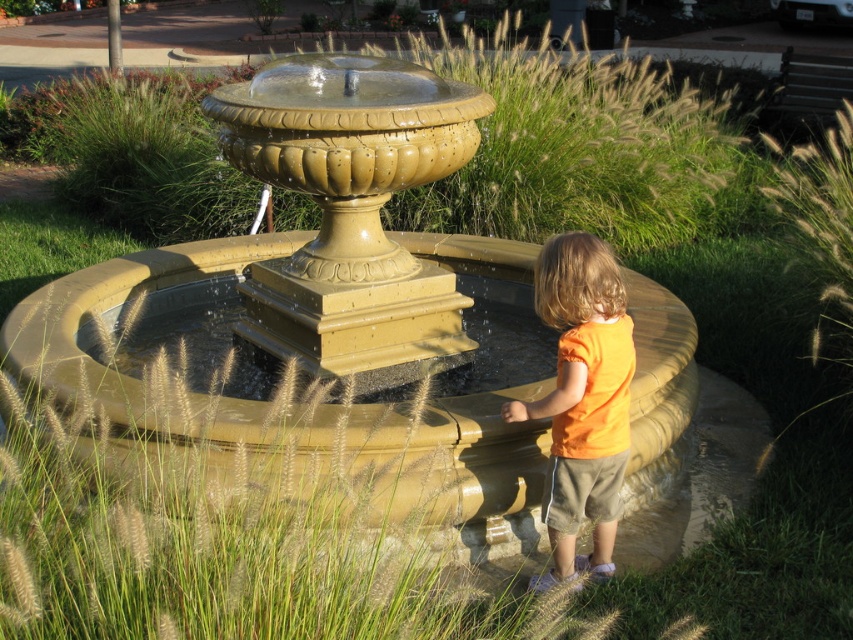
Question: Which of the following is the closest to the observer?

Choices:
 (A) (352, 188)
 (B) (560, 356)

Answer: (B)

Question: Which object is farther from the camera taking this photo?

Choices:
 (A) matte gold fountain at center
 (B) orange cotton shirt at right

Answer: (B)

Question: Does matte gold fountain at center appear on the right side of orange cotton shirt at right?

Choices:
 (A) no
 (B) yes

Answer: (A)

Question: Which of the following is the farthest from the observer?

Choices:
 (A) (64, 424)
 (B) (573, 276)

Answer: (A)

Question: Is matte gold fountain at center below orange cotton shirt at right?

Choices:
 (A) no
 (B) yes

Answer: (A)

Question: Does matte gold fountain at center have a smaller size compared to orange cotton shirt at right?

Choices:
 (A) no
 (B) yes

Answer: (A)